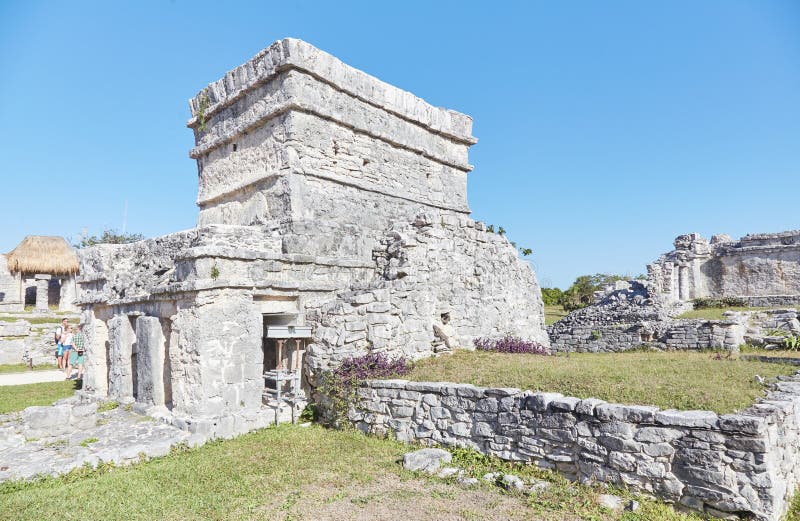
I want to click on entry, so click(x=274, y=353).